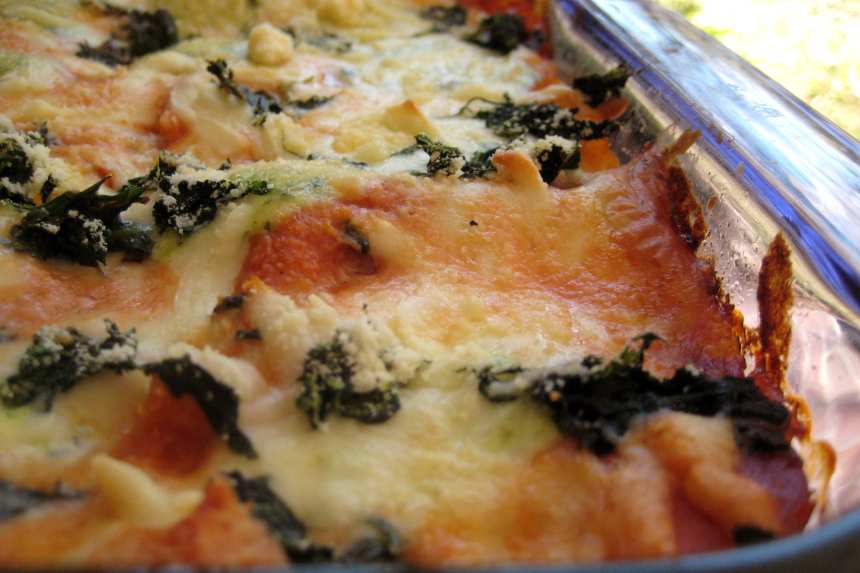
Where is `right side of baking pan`? This screenshot has height=573, width=860. right side of baking pan is located at coordinates (699, 70).